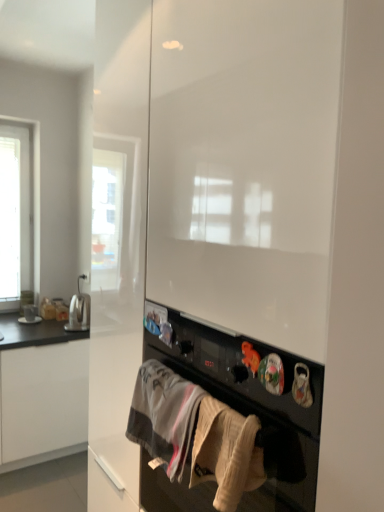
Question: Does white cotton towel at lower center, the 1th clothing in the back-to-front sequence, have a greater width compared to satin silver toaster at left?

Choices:
 (A) no
 (B) yes

Answer: (A)

Question: From a real-world perspective, does white cotton towel at lower center, which appears as the 1th clothing when viewed from the left, sit lower than satin silver toaster at left?

Choices:
 (A) yes
 (B) no

Answer: (B)

Question: Is satin silver toaster at left located within white cotton towel at lower center, marked as the 2th clothing in a front-to-back arrangement?

Choices:
 (A) no
 (B) yes

Answer: (A)

Question: Considering the relative sizes of white cotton towel at lower center, which appears as the 1th clothing when viewed from the left, and satin silver toaster at left in the image provided, is white cotton towel at lower center, which appears as the 1th clothing when viewed from the left, thinner than satin silver toaster at left?

Choices:
 (A) yes
 (B) no

Answer: (A)

Question: Is white cotton towel at lower center, the 1th clothing in the back-to-front sequence, further to camera compared to satin silver toaster at left?

Choices:
 (A) no
 (B) yes

Answer: (A)

Question: Considering the positions of black matte oven at center and white cotton towel at lower center, which appears as the 1th clothing when viewed from the left, in the image, is black matte oven at center taller or shorter than white cotton towel at lower center, which appears as the 1th clothing when viewed from the left,?

Choices:
 (A) tall
 (B) short

Answer: (A)

Question: From a real-world perspective, relative to white cotton towel at lower center, acting as the second clothing starting from the right, is black matte oven at center vertically above or below?

Choices:
 (A) above
 (B) below

Answer: (B)

Question: Relative to white cotton towel at lower center, marked as the 2th clothing in a front-to-back arrangement, is black matte oven at center in front or behind?

Choices:
 (A) behind
 (B) front

Answer: (B)

Question: In the image, is black matte oven at center on the left side or the right side of white cotton towel at lower center, acting as the second clothing starting from the right?

Choices:
 (A) left
 (B) right

Answer: (B)

Question: In terms of width, does satin silver toaster at left look wider or thinner when compared to beige cotton towel at lower center, which appears as the first clothing when viewed from the front?

Choices:
 (A) wide
 (B) thin

Answer: (A)

Question: Visually, is satin silver toaster at left positioned to the left or to the right of beige cotton towel at lower center, which appears as the first clothing when viewed from the front?

Choices:
 (A) right
 (B) left

Answer: (B)

Question: Relative to beige cotton towel at lower center, acting as the second clothing starting from the left, is satin silver toaster at left in front or behind?

Choices:
 (A) front
 (B) behind

Answer: (B)

Question: Choose the correct answer: Is satin silver toaster at left inside beige cotton towel at lower center, which is counted as the second clothing, starting from the back, or outside it?

Choices:
 (A) inside
 (B) outside

Answer: (B)

Question: Considering the positions of black matte oven at center and satin silver toaster at left in the image, is black matte oven at center wider or thinner than satin silver toaster at left?

Choices:
 (A) wide
 (B) thin

Answer: (A)

Question: In the image, is black matte oven at center positioned in front of or behind satin silver toaster at left?

Choices:
 (A) behind
 (B) front

Answer: (B)